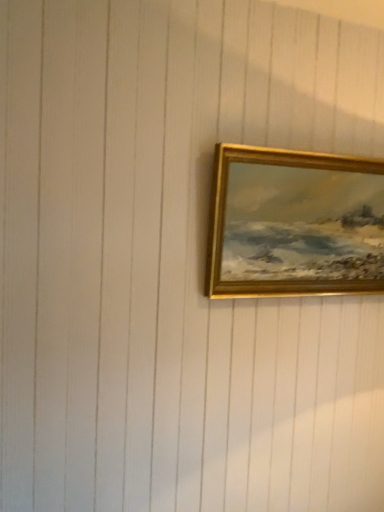
The width and height of the screenshot is (384, 512). What do you see at coordinates (294, 223) in the screenshot?
I see `gold metallic picture frame at upper right` at bounding box center [294, 223].

You are a GUI agent. You are given a task and a screenshot of the screen. Output one action in this format:
    pyautogui.click(x=<x>, y=<y>)
    Task: Click on the gold metallic picture frame at upper right
    
    Given the screenshot: What is the action you would take?
    (x=294, y=223)

Locate an element on the screen. gold metallic picture frame at upper right is located at coordinates (294, 223).